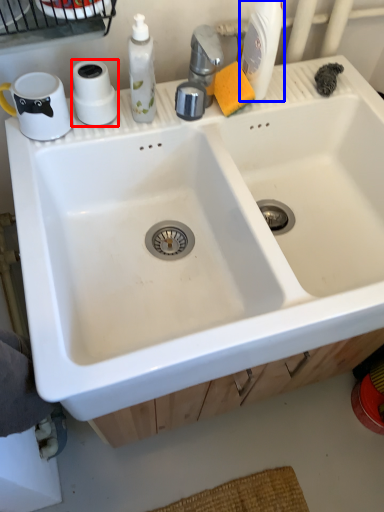
Question: Which of the following is the farthest to the observer, toilet paper (highlighted by a red box) or cleaning product (highlighted by a blue box)?

Choices:
 (A) toilet paper
 (B) cleaning product

Answer: (A)